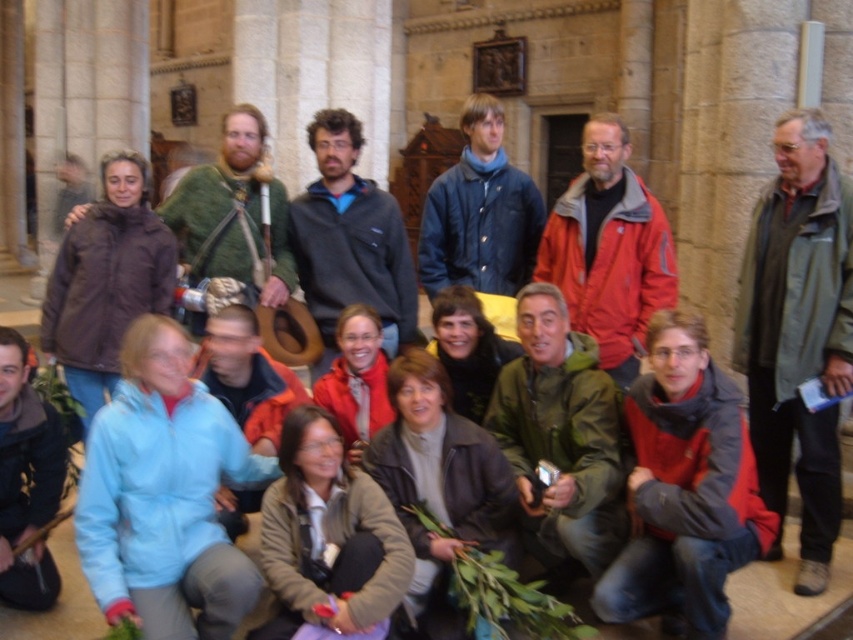
Measure the distance between point (828,314) and camera.

Point (828,314) and camera are 23.29 meters apart from each other.

Where is `green matte jacket at right`? The image size is (853, 640). green matte jacket at right is located at coordinates (798, 332).

Is point (766, 346) farther from camera compared to point (610, 152)?

No, (766, 346) is closer to viewer.

This screenshot has width=853, height=640. What do you see at coordinates (798, 332) in the screenshot?
I see `green matte jacket at right` at bounding box center [798, 332].

Is point (824, 317) behind point (579, 227)?

No.

You are a GUI agent. You are given a task and a screenshot of the screen. Output one action in this format:
    pyautogui.click(x=<x>, y=<y>)
    Task: Click on the green matte jacket at right
    The height and width of the screenshot is (640, 853).
    Given the screenshot: What is the action you would take?
    pyautogui.click(x=798, y=332)

Which is above, green matte jacket at center or matte red jacket at center?

Positioned higher is matte red jacket at center.

Who is more distant from viewer, (x=549, y=561) or (x=589, y=141)?

Point (x=589, y=141)

Where is `green matte jacket at center`? Image resolution: width=853 pixels, height=640 pixels. green matte jacket at center is located at coordinates (561, 436).